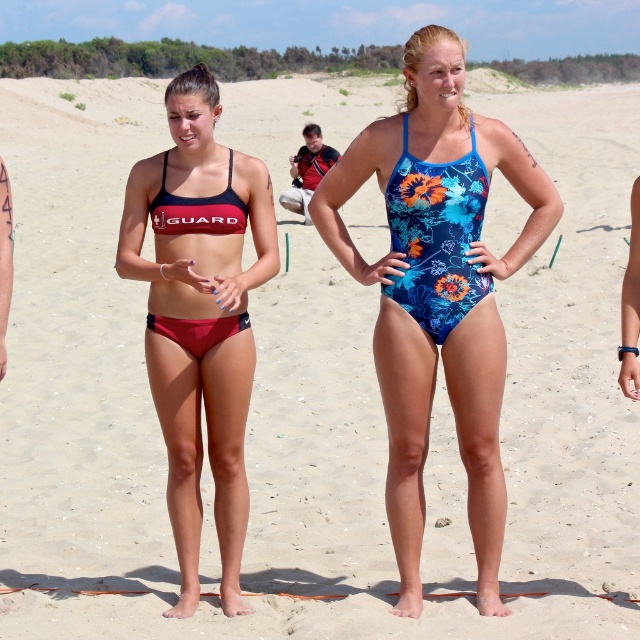
Consider the image. Is matte red bikini bottom at left in front of matte red bikini top at center?

That is True.

Who is more distant from viewer, (x=196, y=99) or (x=241, y=212)?

Positioned behind is point (x=241, y=212).

Is point (234, 356) positioned behind point (243, 218)?

No, (234, 356) is in front of (243, 218).

This screenshot has height=640, width=640. Find the location of `matte red bikini bottom at left`. matte red bikini bottom at left is located at coordinates [x=198, y=316].

Does floral printed swimsuit at center have a lesser width compared to matte red bikini bottom at left?

In fact, floral printed swimsuit at center might be wider than matte red bikini bottom at left.

How much distance is there between floral printed swimsuit at center and matte red bikini bottom at left?

floral printed swimsuit at center is 30.61 inches from matte red bikini bottom at left.

Is point (433, 132) positioned behind point (253, 241)?

No, it is in front of (253, 241).

Identify the location of floral printed swimsuit at center. This screenshot has height=640, width=640. (438, 291).

Who is shorter, floral printed swimsuit at center or floral print swimsuit at center?

floral print swimsuit at center

Who is positioned more to the right, floral printed swimsuit at center or floral print swimsuit at center?

Positioned to the right is floral printed swimsuit at center.

Is point (336, 184) closer to camera compared to point (444, 205)?

No.

Find the location of a particular element. The image size is (640, 640). floral printed swimsuit at center is located at coordinates pyautogui.click(x=438, y=291).